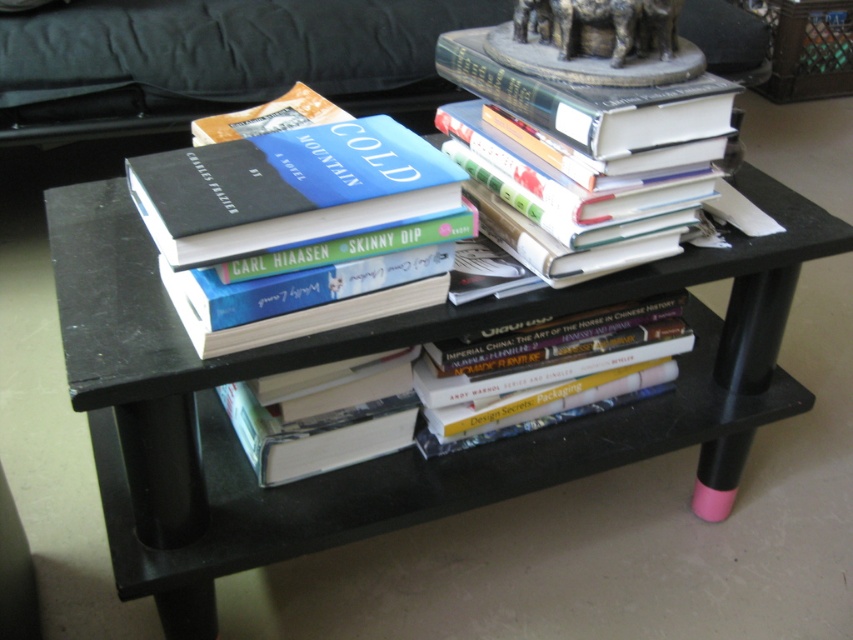
Looking at this image, how far apart are matte black book at center and hardcover books at center?

matte black book at center and hardcover books at center are 21.26 centimeters apart.

Is matte black book at center wider than hardcover books at center?

Yes, matte black book at center is wider than hardcover books at center.

Who is more forward, (x=306, y=209) or (x=589, y=120)?

Point (x=306, y=209) is more forward.

The height and width of the screenshot is (640, 853). I want to click on matte black book at center, so click(x=288, y=188).

Which of these two, black matte table at center or hardcover books at center, stands shorter?

Standing shorter between the two is hardcover books at center.

Between point (107, 280) and point (595, 116), which one is positioned in front?

Point (595, 116) is in front.

Where is `black matte table at center`? Image resolution: width=853 pixels, height=640 pixels. black matte table at center is located at coordinates (370, 352).

Does hardcover books at center have a lesser height compared to hardcover book at center?

No.

Find the location of a particular element. hardcover books at center is located at coordinates (595, 99).